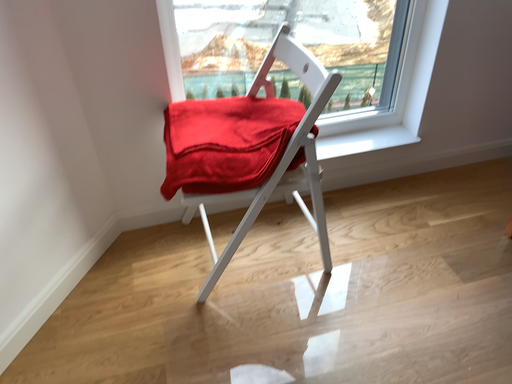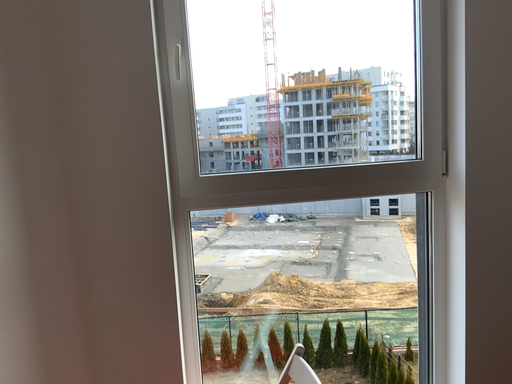
Question: How did the camera likely rotate when shooting the video?

Choices:
 (A) rotated left
 (B) rotated right

Answer: (A)